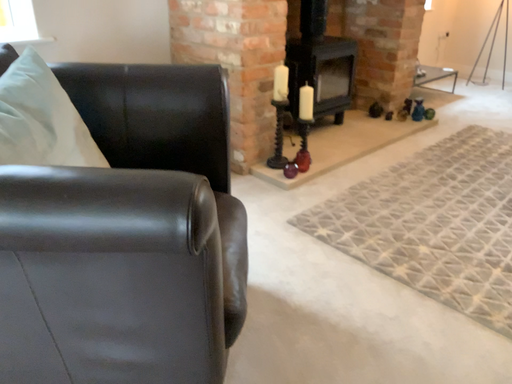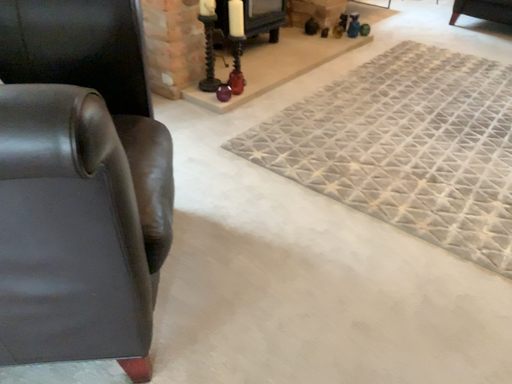
Question: Which way did the camera rotate in the video?

Choices:
 (A) rotated downward
 (B) rotated upward

Answer: (A)